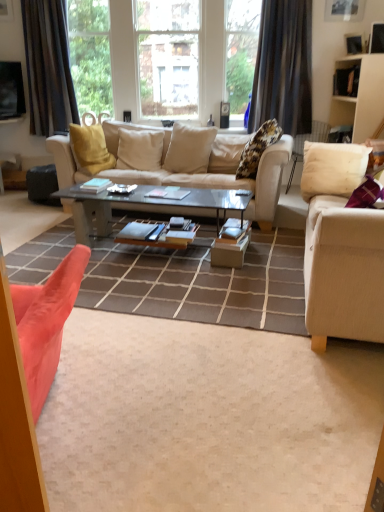
Where is `beige fabric pillow at right, marked as the 1th pillow in a right-to-left arrangement`? This screenshot has width=384, height=512. beige fabric pillow at right, marked as the 1th pillow in a right-to-left arrangement is located at coordinates (333, 168).

The height and width of the screenshot is (512, 384). What do you see at coordinates (333, 168) in the screenshot? I see `beige fabric pillow at right, marked as the 1th pillow in a right-to-left arrangement` at bounding box center [333, 168].

This screenshot has width=384, height=512. What do you see at coordinates (48, 67) in the screenshot? I see `dark gray textured curtain at left, acting as the 1th curtain starting from the left` at bounding box center [48, 67].

How much space does beige fabric studio couch at right, placed as the second studio couch when sorted from left to right, occupy vertically?

The height of beige fabric studio couch at right, placed as the second studio couch when sorted from left to right, is 32.86 inches.

Describe the element at coordinates (139, 149) in the screenshot. I see `beige fabric pillow at center, the fourth pillow when ordered from right to left` at that location.

Measure the distance between point (x=274, y=96) and camera.

Point (x=274, y=96) is 15.10 feet away from camera.

At what (x,y) coordinates should I click in order to perform the action: click on black fabric curtain at upper right, positioned as the second curtain in left-to-right order. Please return your answer as a coordinate pair (x, y). The height and width of the screenshot is (512, 384). Looking at the image, I should click on (283, 67).

Identify the location of beige fabric pillow at right, marked as the 1th pillow in a right-to-left arrangement. The height and width of the screenshot is (512, 384). (333, 168).

How distant is clear glass window at center from velvet pink armchair at lower left?

clear glass window at center and velvet pink armchair at lower left are 4.06 meters apart.

Which object is positioned more to the right, clear glass window at center or velvet pink armchair at lower left?

clear glass window at center.

Could you tell me if clear glass window at center is facing velvet pink armchair at lower left?

Yes, clear glass window at center faces towards velvet pink armchair at lower left.

Where is `plain in front of the clear glass window at center`? This screenshot has width=384, height=512. plain in front of the clear glass window at center is located at coordinates (208, 418).

Considering the relative positions of black fabric curtain at upper right, positioned as the second curtain in left-to-right order, and beige fabric pillow at center, which is the third pillow from right to left, in the image provided, is black fabric curtain at upper right, positioned as the second curtain in left-to-right order, in front of beige fabric pillow at center, which is the third pillow from right to left,?

No, black fabric curtain at upper right, positioned as the second curtain in left-to-right order, is behind beige fabric pillow at center, which is the third pillow from right to left.

From a real-world perspective, is black fabric curtain at upper right, positioned as the second curtain in left-to-right order, below beige fabric pillow at center, which ranks as the second pillow in left-to-right order?

No, from a real-world perspective, black fabric curtain at upper right, positioned as the second curtain in left-to-right order, is not below beige fabric pillow at center, which ranks as the second pillow in left-to-right order.

Does black fabric curtain at upper right, positioned as the second curtain in left-to-right order, have a smaller size compared to beige fabric pillow at center, which ranks as the second pillow in left-to-right order?

Actually, black fabric curtain at upper right, positioned as the second curtain in left-to-right order, might be larger than beige fabric pillow at center, which ranks as the second pillow in left-to-right order.

Is black fabric curtain at upper right, positioned as the 1th curtain in right-to-left order, at the right side of beige fabric pillow at center, which ranks as the second pillow in left-to-right order?

Yes.

Based on the photo, is dark gray textured curtain at left, the 2th curtain when ordered from right to left, thinner than beige fabric pillow at center, which ranks as the second pillow in left-to-right order?

Correct, the width of dark gray textured curtain at left, the 2th curtain when ordered from right to left, is less than that of beige fabric pillow at center, which ranks as the second pillow in left-to-right order.

Is beige fabric pillow at center, which ranks as the second pillow in left-to-right order, at the back of dark gray textured curtain at left, acting as the 1th curtain starting from the left?

No, dark gray textured curtain at left, acting as the 1th curtain starting from the left, is not facing the opposite direction of beige fabric pillow at center, which ranks as the second pillow in left-to-right order.

Who is taller, dark gray textured curtain at left, acting as the 1th curtain starting from the left, or beige fabric pillow at center, which ranks as the second pillow in left-to-right order?

dark gray textured curtain at left, acting as the 1th curtain starting from the left.

From a real-world perspective, is dark gray textured curtain at left, the 2th curtain when ordered from right to left, under beige fabric pillow at center, which ranks as the second pillow in left-to-right order?

Actually, dark gray textured curtain at left, the 2th curtain when ordered from right to left, is physically above beige fabric pillow at center, which ranks as the second pillow in left-to-right order, in the real world.

Is beige fabric pillow at right, placed as the fourth pillow when sorted from left to right, far away from white matte cabinet at upper right?

beige fabric pillow at right, placed as the fourth pillow when sorted from left to right, is far away from white matte cabinet at upper right.

From the image's perspective, between beige fabric pillow at right, placed as the fourth pillow when sorted from left to right, and white matte cabinet at upper right, who is located below?

From the image's view, beige fabric pillow at right, placed as the fourth pillow when sorted from left to right, is below.

Considering the sizes of beige fabric pillow at right, marked as the 1th pillow in a right-to-left arrangement, and white matte cabinet at upper right in the image, is beige fabric pillow at right, marked as the 1th pillow in a right-to-left arrangement, bigger or smaller than white matte cabinet at upper right?

In the image, beige fabric pillow at right, marked as the 1th pillow in a right-to-left arrangement, appears to be larger than white matte cabinet at upper right.

From a real-world perspective, which object stands above the other?

white matte cabinet at upper right, from a real-world perspective.

Which of these two, dark gray textured curtain at left, the 2th curtain when ordered from right to left, or beige fabric studio couch at right, which is the 1th studio couch in right-to-left order, is bigger?

beige fabric studio couch at right, which is the 1th studio couch in right-to-left order, is bigger.

Is beige fabric studio couch at right, placed as the second studio couch when sorted from left to right, completely or partially inside dark gray textured curtain at left, acting as the 1th curtain starting from the left?

That's incorrect, beige fabric studio couch at right, placed as the second studio couch when sorted from left to right, is not inside dark gray textured curtain at left, acting as the 1th curtain starting from the left.

Is point (70, 121) positioned after point (315, 219)?

That is True.

At what (x,y) coordinates should I click in order to perform the action: click on curtain that is the 2nd object located behind the beige fabric studio couch at right, placed as the second studio couch when sorted from left to right. Please return your answer as a coordinate pair (x, y). The width and height of the screenshot is (384, 512). Looking at the image, I should click on (48, 67).

Based on their positions, is white matte cabinet at upper right located to the left or right of beige fabric pillow at center, which ranks as the second pillow in left-to-right order?

In the image, white matte cabinet at upper right appears on the right side of beige fabric pillow at center, which ranks as the second pillow in left-to-right order.

Is white matte cabinet at upper right positioned before beige fabric pillow at center, which is the third pillow from right to left?

Yes, it is in front of beige fabric pillow at center, which is the third pillow from right to left.

Considering the relative sizes of white matte cabinet at upper right and beige fabric pillow at center, which ranks as the second pillow in left-to-right order, in the image provided, is white matte cabinet at upper right wider than beige fabric pillow at center, which ranks as the second pillow in left-to-right order,?

Indeed, white matte cabinet at upper right has a greater width compared to beige fabric pillow at center, which ranks as the second pillow in left-to-right order.

From the image's perspective, which is above, beige fabric pillow at center, the fourth pillow when ordered from right to left, or beige fabric couch at center, the 1th studio couch from the left?

beige fabric pillow at center, the fourth pillow when ordered from right to left, is shown above in the image.

Is beige fabric pillow at center, positioned as the first pillow in left-to-right order, oriented away from beige fabric couch at center, placed as the second studio couch when sorted from right to left?

Yes, beige fabric pillow at center, positioned as the first pillow in left-to-right order, is positioned with its back facing beige fabric couch at center, placed as the second studio couch when sorted from right to left.

From a real-world perspective, who is located higher, beige fabric pillow at center, the fourth pillow when ordered from right to left, or beige fabric couch at center, placed as the second studio couch when sorted from right to left?

beige fabric pillow at center, the fourth pillow when ordered from right to left.

From their relative heights in the image, would you say beige fabric pillow at center, the fourth pillow when ordered from right to left, is taller or shorter than beige fabric couch at center, placed as the second studio couch when sorted from right to left?

Clearly, beige fabric pillow at center, the fourth pillow when ordered from right to left, is shorter compared to beige fabric couch at center, placed as the second studio couch when sorted from right to left.

Where is `window behind the velvet pink armchair at lower left`? The height and width of the screenshot is (512, 384). window behind the velvet pink armchair at lower left is located at coordinates (164, 57).

At what (x,y) coordinates should I click in order to perform the action: click on the 2nd pillow below the black fabric curtain at upper right, positioned as the 1th curtain in right-to-left order (from a real-world perspective). Please return your answer as a coordinate pair (x, y). The image size is (384, 512). Looking at the image, I should click on (189, 149).

Considering their positions, is dark gray textured curtain at left, the 2th curtain when ordered from right to left, positioned further to black fabric curtain at upper right, positioned as the 1th curtain in right-to-left order, than velvet pink armchair at lower left?

velvet pink armchair at lower left is positioned further to the anchor black fabric curtain at upper right, positioned as the 1th curtain in right-to-left order.

Which object lies further to the anchor point beige fabric pillow at center, the fourth pillow when ordered from right to left, beige fabric couch at center, the 1th studio couch from the left, or white matte cabinet at upper right?

white matte cabinet at upper right is positioned further to the anchor beige fabric pillow at center, the fourth pillow when ordered from right to left.

Estimate the real-world distances between objects in this image. Which object is further from beige fabric couch at center, the 1th studio couch from the left, beige fabric pillow at center, positioned as the first pillow in left-to-right order, or beige fabric pillow at center, which is the third pillow from right to left?

Among the two, beige fabric pillow at center, positioned as the first pillow in left-to-right order, is located further to beige fabric couch at center, the 1th studio couch from the left.

Which object lies nearer to the anchor point dark gray textured curtain at left, the 2th curtain when ordered from right to left, black fabric curtain at upper right, positioned as the second curtain in left-to-right order, or beige fabric couch at center, placed as the second studio couch when sorted from right to left?

beige fabric couch at center, placed as the second studio couch when sorted from right to left, lies closer to dark gray textured curtain at left, the 2th curtain when ordered from right to left, than the other object.

Looking at the image, which one is located further to velvet pink armchair at lower left, velvet orange chair at lower left or clear glass window at center?

clear glass window at center.

Looking at this image, estimate the real-world distances between objects in this image. Which object is closer to beige fabric pillow at center, the fourth pillow when ordered from right to left, beige fabric couch at center, placed as the second studio couch when sorted from right to left, or clear glass window at center?

beige fabric couch at center, placed as the second studio couch when sorted from right to left.

Which object lies further to the anchor point beige fabric studio couch at right, which is the 1th studio couch in right-to-left order, clear glass window at center or beige fabric pillow at center, the fourth pillow when ordered from right to left?

clear glass window at center is further to beige fabric studio couch at right, which is the 1th studio couch in right-to-left order.

Which object lies further to the anchor point beige fabric pillow at right, placed as the fourth pillow when sorted from left to right, clear glass window at center or beige fabric couch at center, placed as the second studio couch when sorted from right to left?

clear glass window at center.

At what (x,y) coordinates should I click in order to perform the action: click on window between beige fabric couch at center, the 1th studio couch from the left, and velvet orange armchair at center from front to back. Please return your answer as a coordinate pair (x, y). This screenshot has width=384, height=512. Looking at the image, I should click on (164, 57).

You are a GUI agent. You are given a task and a screenshot of the screen. Output one action in this format:
    pyautogui.click(x=<x>, y=<y>)
    Task: Click on the armchair situated between dark gray textured curtain at left, the 2th curtain when ordered from right to left, and beige fabric pillow at right, placed as the fourth pillow when sorted from left to right, from left to right
    The image size is (384, 512).
    Given the screenshot: What is the action you would take?
    pyautogui.click(x=89, y=119)

You are a GUI agent. You are given a task and a screenshot of the screen. Output one action in this format:
    pyautogui.click(x=<x>, y=<y>)
    Task: Click on the coffee table positioned between beige fabric studio couch at right, which is the 1th studio couch in right-to-left order, and beige fabric couch at center, placed as the second studio couch when sorted from right to left, from near to far
    Image resolution: width=384 pixels, height=512 pixels.
    Given the screenshot: What is the action you would take?
    pyautogui.click(x=144, y=206)

The image size is (384, 512). What are the coordinates of `coffee table between velvet pink armchair at lower left and beige fabric pillow at center, positioned as the first pillow in left-to-right order, along the z-axis` in the screenshot? It's located at (144, 206).